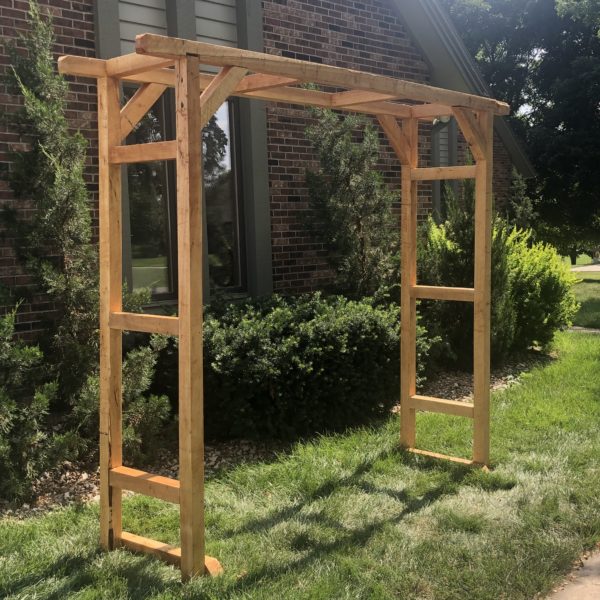
The image size is (600, 600). I want to click on gray painted trim, so click(258, 182).